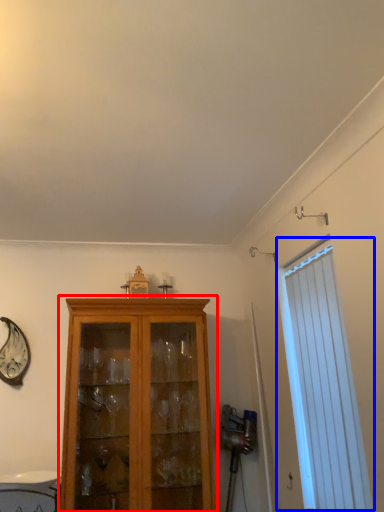
Question: Which object is further to the camera taking this photo, cupboard (highlighted by a red box) or window (highlighted by a blue box)?

Choices:
 (A) cupboard
 (B) window

Answer: (A)